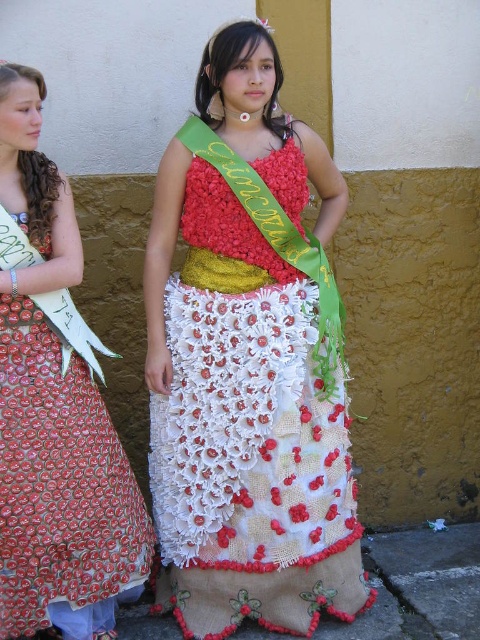
Question: Which point is farther to the camera?

Choices:
 (A) (211, 193)
 (B) (85, 481)

Answer: (A)

Question: In this image, where is textured fabric dress at center located relative to red dotted fabric dress at left?

Choices:
 (A) below
 (B) above

Answer: (B)

Question: Does textured fabric dress at center appear over red dotted fabric dress at left?

Choices:
 (A) yes
 (B) no

Answer: (A)

Question: Does textured fabric dress at center appear on the left side of red dotted fabric dress at left?

Choices:
 (A) yes
 (B) no

Answer: (B)